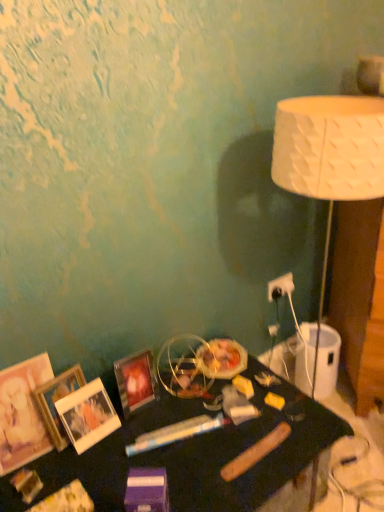
Describe the element at coordinates (136, 381) in the screenshot. The image size is (384, 512). I see `matte glass picture frame at lower left, which is the 4th picture frame in left-to-right order` at that location.

Where is `white matte picture frame at lower left, which is the 2th picture frame in right-to-left order`? white matte picture frame at lower left, which is the 2th picture frame in right-to-left order is located at coordinates (87, 415).

Where is `black glossy table at lower center`? black glossy table at lower center is located at coordinates (199, 452).

What do you see at coordinates (280, 287) in the screenshot? I see `white plastic electric outlet at upper right` at bounding box center [280, 287].

This screenshot has height=512, width=384. Identify the location of white textured lampshade at right. (329, 157).

Would you say white matte picture frame at lower left, the third picture frame viewed from the left, is part of wooden photo frame at lower left, marked as the 3th picture frame in a right-to-left arrangement,'s contents?

No, white matte picture frame at lower left, the third picture frame viewed from the left, is located outside of wooden photo frame at lower left, marked as the 3th picture frame in a right-to-left arrangement.

Based on the photo, considering the positions of objects wooden photo frame at lower left, marked as the 3th picture frame in a right-to-left arrangement, and white matte picture frame at lower left, which is the 2th picture frame in right-to-left order, in the image provided, who is in front, wooden photo frame at lower left, marked as the 3th picture frame in a right-to-left arrangement, or white matte picture frame at lower left, which is the 2th picture frame in right-to-left order,?

wooden photo frame at lower left, marked as the 3th picture frame in a right-to-left arrangement.

Which is less distant, (74, 395) or (298, 436)?

The point (298, 436) is closer.

At what (x,y) coordinates should I click in order to perform the action: click on table that appears below the white matte picture frame at lower left, which is the 2th picture frame in right-to-left order (from the image's perspective). Please return your answer as a coordinate pair (x, y). This screenshot has width=384, height=512. Looking at the image, I should click on (199, 452).

Between white matte picture frame at lower left, which is the 2th picture frame in right-to-left order, and black glossy table at lower center, which one has larger size?

black glossy table at lower center.

Considering the relative positions of white matte picture frame at lower left, which is the 2th picture frame in right-to-left order, and black glossy table at lower center in the image provided, is white matte picture frame at lower left, which is the 2th picture frame in right-to-left order, in front of black glossy table at lower center?

No, it is behind black glossy table at lower center.

Is black glossy table at lower center at the back of white textured lampshade at right?

white textured lampshade at right is not turned away from black glossy table at lower center.

Considering the sizes of objects white textured lampshade at right and black glossy table at lower center in the image provided, who is taller, white textured lampshade at right or black glossy table at lower center?

white textured lampshade at right.

Which object is thinner, white textured lampshade at right or black glossy table at lower center?

Thinner between the two is white textured lampshade at right.

From a real-world perspective, is white textured lampshade at right above or below black glossy table at lower center?

In terms of real-world spatial position, white textured lampshade at right is above black glossy table at lower center.

Can you tell me how much white matte picture frame at lower left, which is the 2th picture frame in right-to-left order, and matte glass picture frame at lower left, which is the first picture frame in right-to-left order, differ in facing direction?

The angular difference between white matte picture frame at lower left, which is the 2th picture frame in right-to-left order, and matte glass picture frame at lower left, which is the first picture frame in right-to-left order, is 5.15 degrees.

Considering their positions, is white matte picture frame at lower left, which is the 2th picture frame in right-to-left order, located in front of or behind matte glass picture frame at lower left, which is the 4th picture frame in left-to-right order?

white matte picture frame at lower left, which is the 2th picture frame in right-to-left order, is in front of matte glass picture frame at lower left, which is the 4th picture frame in left-to-right order.

Which of these two, white matte picture frame at lower left, the third picture frame viewed from the left, or matte glass picture frame at lower left, which is the 4th picture frame in left-to-right order, stands shorter?

matte glass picture frame at lower left, which is the 4th picture frame in left-to-right order.

Who is bigger, white matte picture frame at lower left, which is the 2th picture frame in right-to-left order, or matte glass picture frame at lower left, which is the 4th picture frame in left-to-right order?

Bigger between the two is matte glass picture frame at lower left, which is the 4th picture frame in left-to-right order.

Which is more to the right, white textured lampshade at right or matte glass picture frame at lower left, which is the first picture frame in right-to-left order?

white textured lampshade at right.

Does white textured lampshade at right have a larger size compared to matte glass picture frame at lower left, which is the 4th picture frame in left-to-right order?

Yes, white textured lampshade at right is bigger than matte glass picture frame at lower left, which is the 4th picture frame in left-to-right order.

Looking at this image, from the image's perspective, is white textured lampshade at right above or below matte glass picture frame at lower left, which is the 4th picture frame in left-to-right order?

Clearly, from the image's perspective, white textured lampshade at right is above matte glass picture frame at lower left, which is the 4th picture frame in left-to-right order.

Between white textured lampshade at right and matte glass picture frame at lower left, which is the 4th picture frame in left-to-right order, which one has more height?

white textured lampshade at right.

Can you tell me how much white plastic electric outlet at upper right and matte glass picture frame at lower left, which is the 4th picture frame in left-to-right order, differ in facing direction?

They differ by 1.27 degrees in their facing directions.

Consider the image. Is white plastic electric outlet at upper right to the right of matte glass picture frame at lower left, which is the first picture frame in right-to-left order, from the viewer's perspective?

Indeed, white plastic electric outlet at upper right is positioned on the right side of matte glass picture frame at lower left, which is the first picture frame in right-to-left order.

From the image's perspective, which object appears higher, white plastic electric outlet at upper right or matte glass picture frame at lower left, which is the first picture frame in right-to-left order?

white plastic electric outlet at upper right.

Can you confirm if white plastic electric outlet at upper right is wider than matte glass picture frame at lower left, which is the 4th picture frame in left-to-right order?

Incorrect, the width of white plastic electric outlet at upper right does not surpass that of matte glass picture frame at lower left, which is the 4th picture frame in left-to-right order.

Would you say matte wooden picture frame at left, which ranks as the fourth picture frame in right-to-left order, is to the left or to the right of white plastic electric outlet at upper right in the picture?

Clearly, matte wooden picture frame at left, which ranks as the fourth picture frame in right-to-left order, is on the left of white plastic electric outlet at upper right in the image.

Where is `electric outlet that is behind the matte wooden picture frame at left, which ranks as the fourth picture frame in right-to-left order`? This screenshot has height=512, width=384. electric outlet that is behind the matte wooden picture frame at left, which ranks as the fourth picture frame in right-to-left order is located at coordinates (280, 287).

From a real-world perspective, count 2nd picture frames upward from the white matte picture frame at lower left, the third picture frame viewed from the left, and point to it. Please provide its 2D coordinates.

[(56, 401)]

You are a GUI agent. You are given a task and a screenshot of the screen. Output one action in this format:
    pyautogui.click(x=<x>, y=<y>)
    Task: Click on the 2nd picture frame counting from the left side of the black glossy table at lower center
    
    Given the screenshot: What is the action you would take?
    pyautogui.click(x=87, y=415)

Considering their positions, is white textured lampshade at right positioned closer to matte wooden picture frame at left, which ranks as the fourth picture frame in right-to-left order, than black glossy table at lower center?

black glossy table at lower center.

Looking at the image, which one is located further to white plastic electric outlet at upper right, matte wooden picture frame at left, positioned as the 1th picture frame in left-to-right order, or black glossy table at lower center?

Based on the image, matte wooden picture frame at left, positioned as the 1th picture frame in left-to-right order, appears to be further to white plastic electric outlet at upper right.

Based on their spatial positions, is white plastic electric outlet at upper right or matte wooden picture frame at left, positioned as the 1th picture frame in left-to-right order, closer to white matte picture frame at lower left, which is the 2th picture frame in right-to-left order?

matte wooden picture frame at left, positioned as the 1th picture frame in left-to-right order, is closer to white matte picture frame at lower left, which is the 2th picture frame in right-to-left order.

Looking at the image, which one is located closer to matte glass picture frame at lower left, which is the first picture frame in right-to-left order, white matte picture frame at lower left, which is the 2th picture frame in right-to-left order, or wooden photo frame at lower left, marked as the 3th picture frame in a right-to-left arrangement?

Among the two, white matte picture frame at lower left, which is the 2th picture frame in right-to-left order, is located nearer to matte glass picture frame at lower left, which is the first picture frame in right-to-left order.

Consider the image. From the image, which object appears to be nearer to white textured lampshade at right, matte glass picture frame at lower left, which is the 4th picture frame in left-to-right order, or matte wooden picture frame at left, which ranks as the fourth picture frame in right-to-left order?

Based on the image, matte glass picture frame at lower left, which is the 4th picture frame in left-to-right order, appears to be nearer to white textured lampshade at right.

Which object lies nearer to the anchor point white plastic electric outlet at upper right, wooden photo frame at lower left, marked as the 3th picture frame in a right-to-left arrangement, or white textured lampshade at right?

white textured lampshade at right is positioned closer to the anchor white plastic electric outlet at upper right.

Considering their positions, is matte glass picture frame at lower left, which is the first picture frame in right-to-left order, positioned further to matte wooden picture frame at left, which ranks as the fourth picture frame in right-to-left order, than black glossy table at lower center?

Based on the image, black glossy table at lower center appears to be further to matte wooden picture frame at left, which ranks as the fourth picture frame in right-to-left order.

Looking at the image, which one is located further to black glossy table at lower center, white plastic electric outlet at upper right or wooden photo frame at lower left, placed as the second picture frame when sorted from left to right?

white plastic electric outlet at upper right.

At what (x,y) coordinates should I click in order to perform the action: click on picture frame between matte wooden picture frame at left, positioned as the 1th picture frame in left-to-right order, and white matte picture frame at lower left, which is the 2th picture frame in right-to-left order, in the horizontal direction. Please return your answer as a coordinate pair (x, y). The height and width of the screenshot is (512, 384). Looking at the image, I should click on point(56,401).

In order to click on table between matte glass picture frame at lower left, which is the 4th picture frame in left-to-right order, and white textured lampshade at right from left to right in this screenshot , I will do `click(199, 452)`.

Identify the location of electric outlet located between wooden photo frame at lower left, placed as the second picture frame when sorted from left to right, and white textured lampshade at right in the left-right direction. (280, 287).

Find the location of a particular element. This screenshot has width=384, height=512. electric outlet between white matte picture frame at lower left, which is the 2th picture frame in right-to-left order, and white textured lampshade at right is located at coordinates pyautogui.click(x=280, y=287).